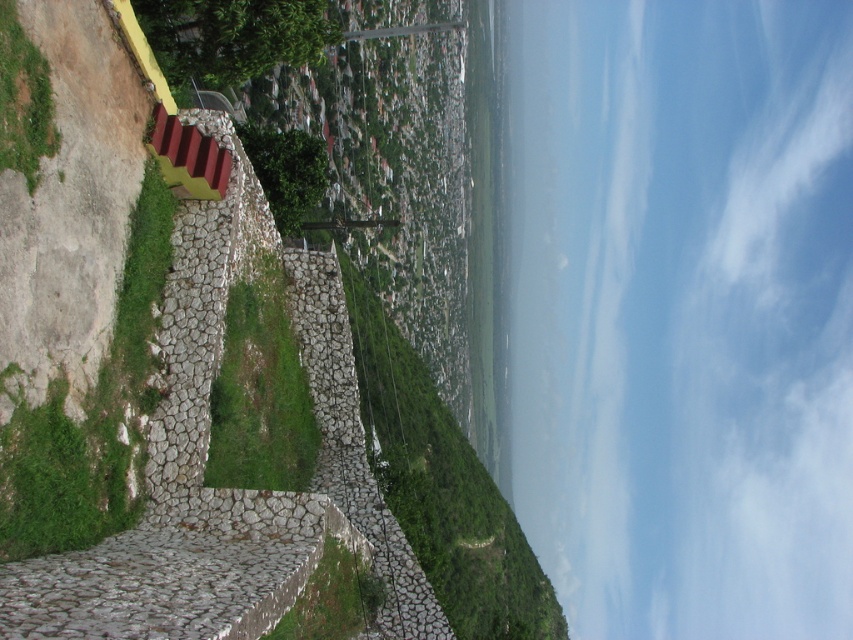
Question: Can you confirm if green mossy stone at lower left is positioned below green grass at center?

Choices:
 (A) yes
 (B) no

Answer: (B)

Question: Which is farther from the green rough stone at lower center?

Choices:
 (A) green leafy grass at center
 (B) green leafy grass at lower left
 (C) green grass at center

Answer: (A)

Question: Does green leafy grass at center have a smaller size compared to green rough stone at lower center?

Choices:
 (A) no
 (B) yes

Answer: (A)

Question: Which point is farther from the camera taking this photo?

Choices:
 (A) (0, 35)
 (B) (42, 413)
 (C) (409, 429)

Answer: (C)

Question: Does green leafy grass at center have a greater width compared to green mossy stone at lower left?

Choices:
 (A) yes
 (B) no

Answer: (A)

Question: Which point appears farthest from the camera in this image?

Choices:
 (A) (459, 532)
 (B) (231, 328)
 (C) (3, 80)

Answer: (A)